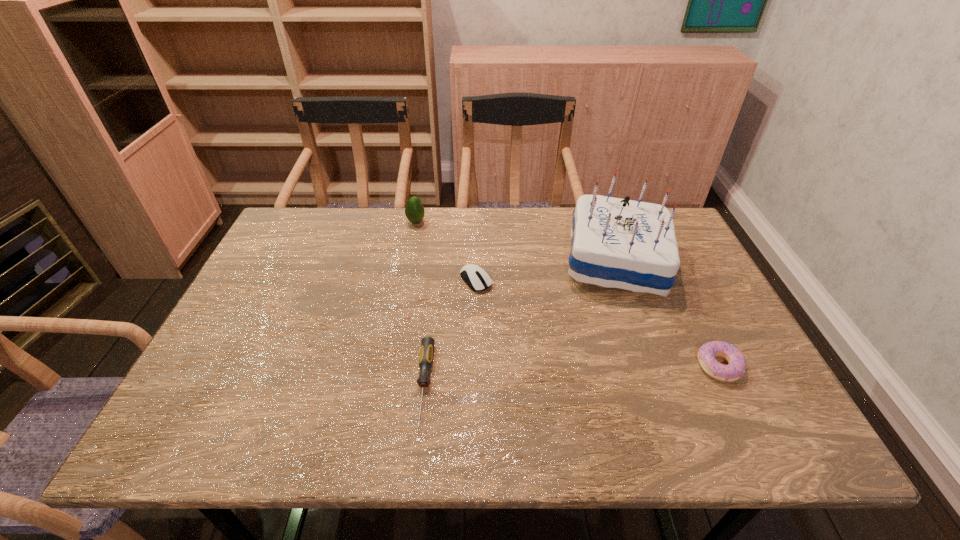
In the image, there is a desktop. Where is `vacant space at the far left corner`? This screenshot has height=540, width=960. vacant space at the far left corner is located at coordinates (287, 232).

I want to click on vacant space at the far right corner, so click(x=684, y=243).

Locate an element on the screen. The image size is (960, 540). free location at the near right corner is located at coordinates (780, 443).

Locate an element on the screen. empty space that is in between the leftmost object and the birthday cake is located at coordinates (516, 241).

I want to click on free space between the mouse and the shortest object, so click(450, 333).

Find the location of a particular element. free area in between the avocado and the mouse is located at coordinates (445, 251).

Locate an element on the screen. free space between the tallest object and the shortest object is located at coordinates (519, 323).

Locate an element on the screen. Image resolution: width=960 pixels, height=540 pixels. unoccupied area between the birthday cake and the leftmost object is located at coordinates (516, 241).

Identify the location of free point between the shortest object and the avocado. This screenshot has width=960, height=540. point(420,303).

Identify the location of free spot between the birthday cake and the avocado. click(x=516, y=241).